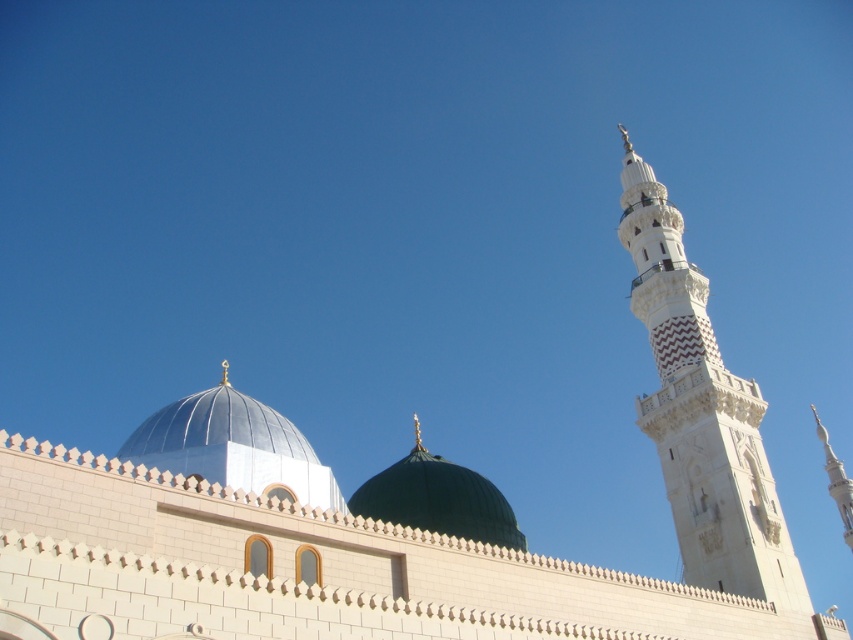
Is white stone minaret at right taller than metallic silver dome at center?

Indeed, white stone minaret at right has a greater height compared to metallic silver dome at center.

Is point (670, 236) farther from camera compared to point (204, 436)?

That is True.

Locate an element on the screen. This screenshot has width=853, height=640. white stone minaret at right is located at coordinates (701, 413).

Does white stone minaret at right appear on the left side of green matte dome at center?

Incorrect, white stone minaret at right is not on the left side of green matte dome at center.

How distant is white stone minaret at right from green matte dome at center?

The distance of white stone minaret at right from green matte dome at center is 22.68 meters.

Is point (700, 380) farther from viewer compared to point (482, 490)?

Yes, it is.

The image size is (853, 640). In order to click on white stone minaret at right in this screenshot , I will do `click(701, 413)`.

Does point (288, 440) come in front of point (491, 531)?

Yes, it is.

Is the position of metallic silver dome at center more distant than that of green matte dome at center?

That is True.

You are a GUI agent. You are given a task and a screenshot of the screen. Output one action in this format:
    pyautogui.click(x=<x>, y=<y>)
    Task: Click on the metallic silver dome at center
    The width and height of the screenshot is (853, 640).
    Given the screenshot: What is the action you would take?
    pyautogui.click(x=233, y=445)